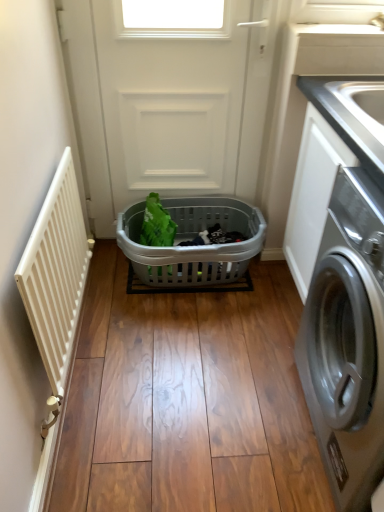
Question: Can you confirm if gray plastic basket at center is wider than white matte screen door at center?

Choices:
 (A) no
 (B) yes

Answer: (B)

Question: Does gray plastic basket at center have a lesser height compared to white matte screen door at center?

Choices:
 (A) yes
 (B) no

Answer: (A)

Question: Is gray plastic basket at center bigger than white matte screen door at center?

Choices:
 (A) no
 (B) yes

Answer: (A)

Question: Is gray plastic basket at center aimed at white matte screen door at center?

Choices:
 (A) no
 (B) yes

Answer: (A)

Question: Considering the relative positions of gray plastic basket at center and white matte screen door at center in the image provided, is gray plastic basket at center in front of white matte screen door at center?

Choices:
 (A) no
 (B) yes

Answer: (A)

Question: From a real-world perspective, is gray plastic basket at center positioned above or below silver metallic washing machine at right?

Choices:
 (A) below
 (B) above

Answer: (A)

Question: From the image's perspective, is gray plastic basket at center above or below silver metallic washing machine at right?

Choices:
 (A) below
 (B) above

Answer: (B)

Question: In the image, is gray plastic basket at center on the left side or the right side of silver metallic washing machine at right?

Choices:
 (A) left
 (B) right

Answer: (A)

Question: Based on their sizes in the image, would you say gray plastic basket at center is bigger or smaller than silver metallic washing machine at right?

Choices:
 (A) small
 (B) big

Answer: (A)

Question: From the image's perspective, is white matte screen door at center located above or below silver metallic washing machine at right?

Choices:
 (A) below
 (B) above

Answer: (B)

Question: From a real-world perspective, relative to silver metallic washing machine at right, is white matte screen door at center vertically above or below?

Choices:
 (A) above
 (B) below

Answer: (A)

Question: In the image, is white matte screen door at center positioned in front of or behind silver metallic washing machine at right?

Choices:
 (A) behind
 (B) front

Answer: (A)

Question: Is white matte screen door at center situated inside silver metallic washing machine at right or outside?

Choices:
 (A) inside
 (B) outside

Answer: (B)

Question: Looking at their shapes, would you say white matte radiator at left is wider or thinner than white matte screen door at center?

Choices:
 (A) wide
 (B) thin

Answer: (B)

Question: Is white matte radiator at left taller or shorter than white matte screen door at center?

Choices:
 (A) tall
 (B) short

Answer: (B)